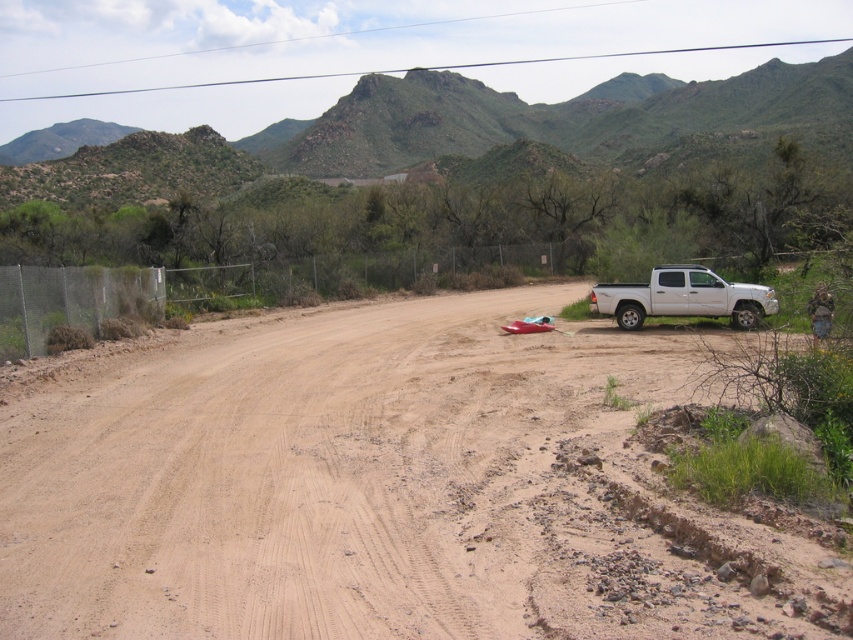
Question: Which of the following is the farthest from the observer?

Choices:
 (A) (659, 266)
 (B) (706, 124)
 (C) (177, 627)

Answer: (B)

Question: Is green textured mountain at upper center below white matte truck at right?

Choices:
 (A) yes
 (B) no

Answer: (B)

Question: Which point is farther from the camera taking this photo?

Choices:
 (A) (650, 296)
 (B) (117, 196)

Answer: (B)

Question: Is green textured mountain at upper center to the left of white matte truck at right from the viewer's perspective?

Choices:
 (A) yes
 (B) no

Answer: (A)

Question: Is dull brown dirt at center smaller than white matte truck at right?

Choices:
 (A) yes
 (B) no

Answer: (B)

Question: Which object is positioned closest to the dull brown dirt at center?

Choices:
 (A) green textured mountain at upper center
 (B) white matte truck at right

Answer: (B)